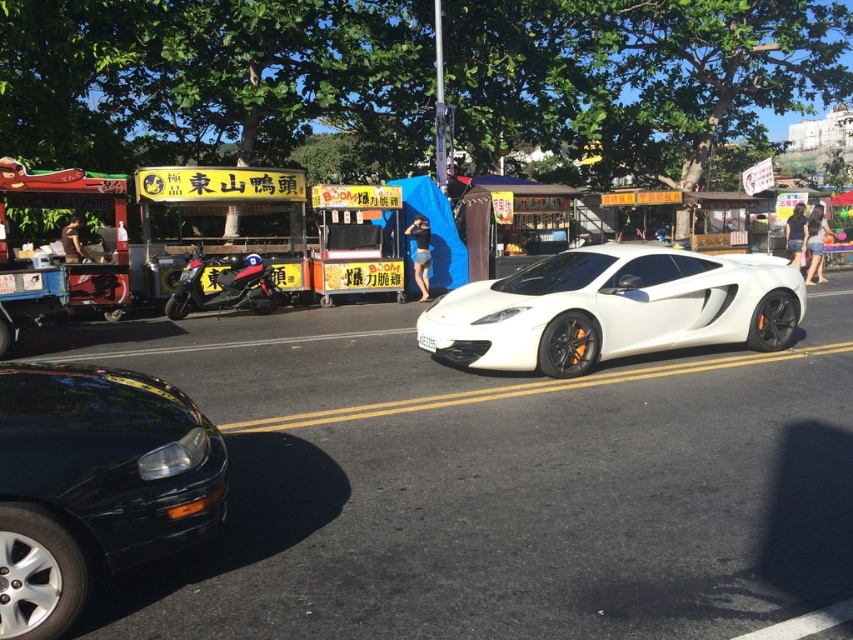
Based on the photo, is white glossy sports car at center further to the viewer compared to white plastic license plate at center?

No, white glossy sports car at center is closer to the viewer.

Does white glossy sports car at center have a smaller size compared to white plastic license plate at center?

No.

Describe the element at coordinates (614, 308) in the screenshot. I see `white glossy sports car at center` at that location.

Identify the location of white glossy sports car at center. The height and width of the screenshot is (640, 853). (614, 308).

Who is shorter, white glossy sports car at center or shiny black motorcycle at left?

shiny black motorcycle at left

The image size is (853, 640). Find the location of `white glossy sports car at center`. white glossy sports car at center is located at coordinates (614, 308).

You are a GUI agent. You are given a task and a screenshot of the screen. Output one action in this format:
    pyautogui.click(x=<x>, y=<y>)
    Task: Click on the white glossy sports car at center
    The image size is (853, 640).
    Given the screenshot: What is the action you would take?
    pyautogui.click(x=614, y=308)

Which is more to the right, glossy black sedan at lower left or white glossy sports car at center?

Positioned to the right is white glossy sports car at center.

Does point (212, 476) come in front of point (582, 321)?

Yes, point (212, 476) is closer to viewer.

In order to click on glossy black sedan at lower left in this screenshot , I will do `click(94, 483)`.